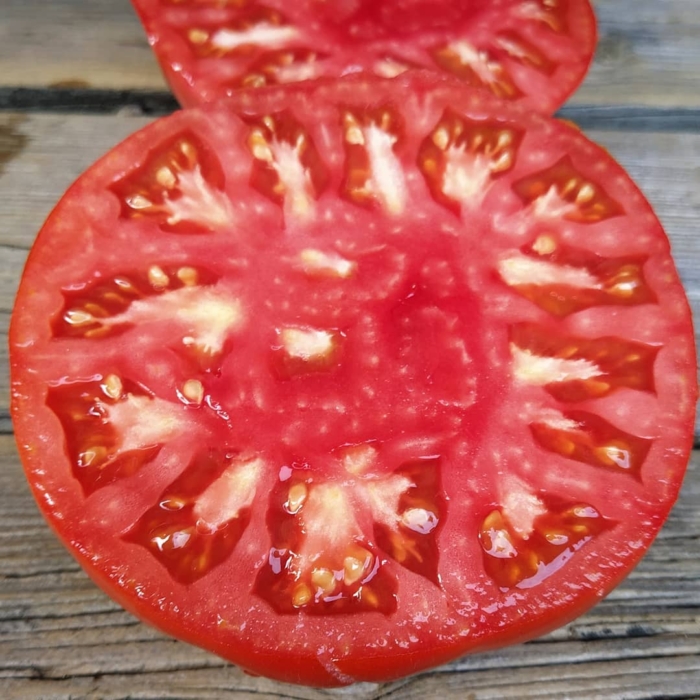
Find the location of `table`. table is located at coordinates (48, 609), (643, 103), (662, 629).